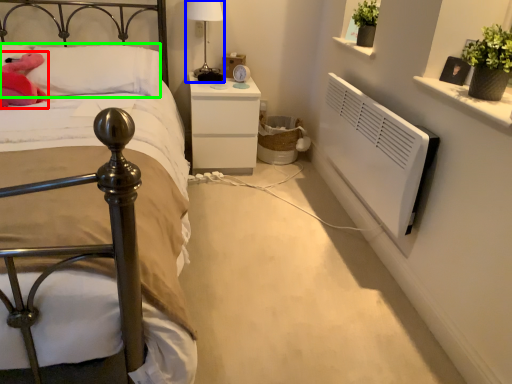
Question: Which is farther away from animal (highlighted by a red box)? bedside lamp (highlighted by a blue box) or pillow (highlighted by a green box)?

Choices:
 (A) bedside lamp
 (B) pillow

Answer: (A)